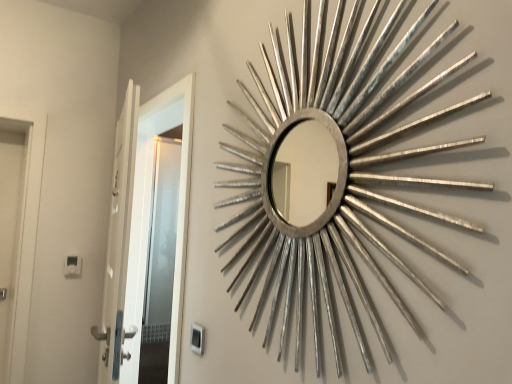
Question: Does silver metallic sunburst mirror at upper right touch white glossy door at left?

Choices:
 (A) no
 (B) yes

Answer: (A)

Question: Is silver metallic sunburst mirror at upper right oriented towards white glossy door at left?

Choices:
 (A) yes
 (B) no

Answer: (B)

Question: From a real-world perspective, is silver metallic sunburst mirror at upper right beneath white glossy door at left?

Choices:
 (A) no
 (B) yes

Answer: (A)

Question: From the image's perspective, is silver metallic sunburst mirror at upper right above white glossy door at left?

Choices:
 (A) yes
 (B) no

Answer: (A)

Question: Does silver metallic sunburst mirror at upper right contain white glossy door at left?

Choices:
 (A) yes
 (B) no

Answer: (B)

Question: Does silver metallic sunburst mirror at upper right have a greater height compared to white glossy door at left?

Choices:
 (A) yes
 (B) no

Answer: (B)

Question: Is white glossy door at left oriented away from silver metallic sunburst mirror at upper right?

Choices:
 (A) no
 (B) yes

Answer: (A)

Question: From the image's perspective, is white glossy door at left under silver metallic sunburst mirror at upper right?

Choices:
 (A) yes
 (B) no

Answer: (A)

Question: Is white glossy door at left thinner than silver metallic sunburst mirror at upper right?

Choices:
 (A) yes
 (B) no

Answer: (B)

Question: Considering the relative sizes of white glossy door at left and silver metallic sunburst mirror at upper right in the image provided, is white glossy door at left bigger than silver metallic sunburst mirror at upper right?

Choices:
 (A) yes
 (B) no

Answer: (A)

Question: Does white glossy door at left have a lesser height compared to silver metallic sunburst mirror at upper right?

Choices:
 (A) no
 (B) yes

Answer: (A)

Question: Can you confirm if white glossy door at left is positioned to the left of silver metallic sunburst mirror at upper right?

Choices:
 (A) no
 (B) yes

Answer: (B)

Question: Considering the positions of silver metallic sunburst mirror at upper right and white glossy door at left in the image, is silver metallic sunburst mirror at upper right bigger or smaller than white glossy door at left?

Choices:
 (A) small
 (B) big

Answer: (A)